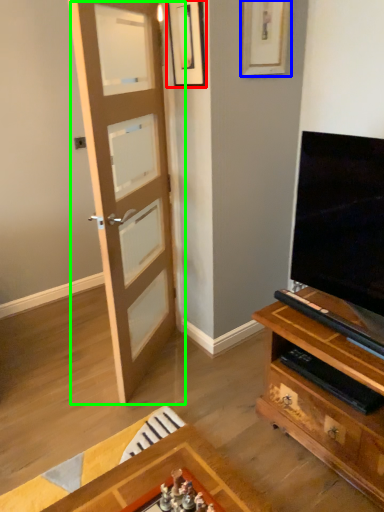
Question: Which object is positioned farthest from picture frame (highlighted by a red box)? Select from picture frame (highlighted by a blue box) and door (highlighted by a green box).

Choices:
 (A) picture frame
 (B) door

Answer: (B)